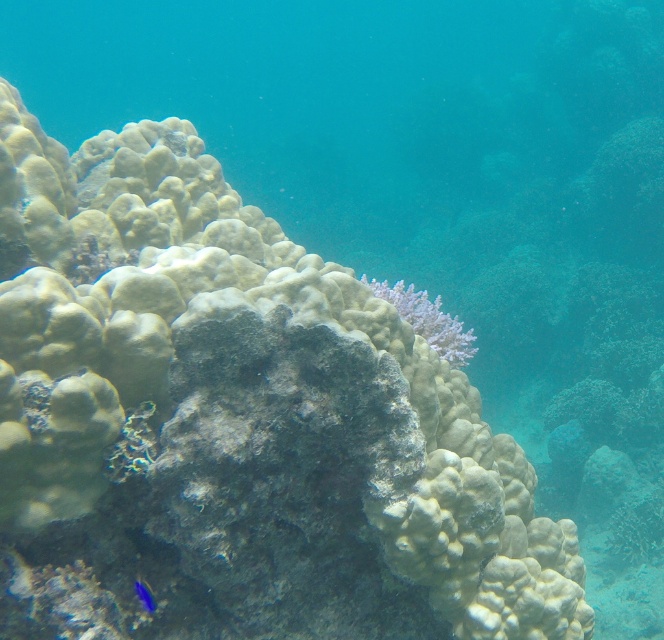
Can you confirm if white matte coral at center is wider than blue glossy fish at lower left?

Yes.

Between white matte coral at center and blue glossy fish at lower left, which one is positioned lower?

blue glossy fish at lower left

The image size is (664, 640). What do you see at coordinates (428, 320) in the screenshot? I see `white matte coral at center` at bounding box center [428, 320].

In order to click on white matte coral at center in this screenshot , I will do `click(428, 320)`.